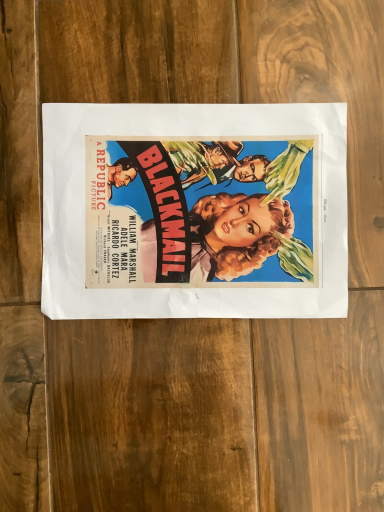
Identify the location of vacant point above matte paper poster at center (from a real-world perspective). pyautogui.click(x=192, y=210).